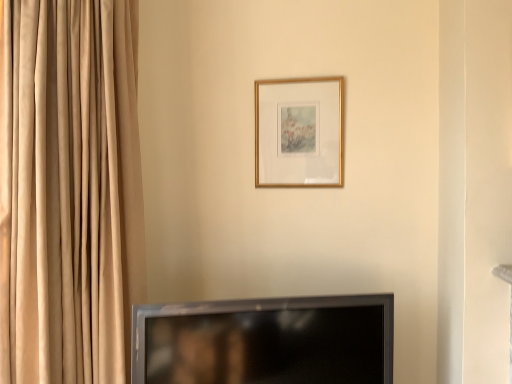
Question: Is gold metallic picture frame at upper center bigger than black glossy tv at lower center?

Choices:
 (A) no
 (B) yes

Answer: (A)

Question: Considering the relative sizes of gold metallic picture frame at upper center and black glossy tv at lower center in the image provided, is gold metallic picture frame at upper center thinner than black glossy tv at lower center?

Choices:
 (A) yes
 (B) no

Answer: (A)

Question: Considering the relative sizes of gold metallic picture frame at upper center and black glossy tv at lower center in the image provided, is gold metallic picture frame at upper center smaller than black glossy tv at lower center?

Choices:
 (A) no
 (B) yes

Answer: (B)

Question: From a real-world perspective, is gold metallic picture frame at upper center physically above black glossy tv at lower center?

Choices:
 (A) yes
 (B) no

Answer: (A)

Question: Is gold metallic picture frame at upper center further to camera compared to black glossy tv at lower center?

Choices:
 (A) yes
 (B) no

Answer: (A)

Question: Is gold metallic picture frame at upper center touching black glossy tv at lower center?

Choices:
 (A) yes
 (B) no

Answer: (B)

Question: Is black glossy tv at lower center facing away from gold metallic picture frame at upper center?

Choices:
 (A) no
 (B) yes

Answer: (A)

Question: Does black glossy tv at lower center turn towards gold metallic picture frame at upper center?

Choices:
 (A) no
 (B) yes

Answer: (A)

Question: From the image's perspective, would you say black glossy tv at lower center is shown under gold metallic picture frame at upper center?

Choices:
 (A) no
 (B) yes

Answer: (B)

Question: From the image's perspective, is black glossy tv at lower center located above gold metallic picture frame at upper center?

Choices:
 (A) yes
 (B) no

Answer: (B)

Question: Is black glossy tv at lower center positioned beyond the bounds of gold metallic picture frame at upper center?

Choices:
 (A) yes
 (B) no

Answer: (A)

Question: Does black glossy tv at lower center have a greater width compared to gold metallic picture frame at upper center?

Choices:
 (A) no
 (B) yes

Answer: (B)

Question: Visually, is black glossy tv at lower center positioned to the left or to the right of gold metallic picture frame at upper center?

Choices:
 (A) right
 (B) left

Answer: (B)